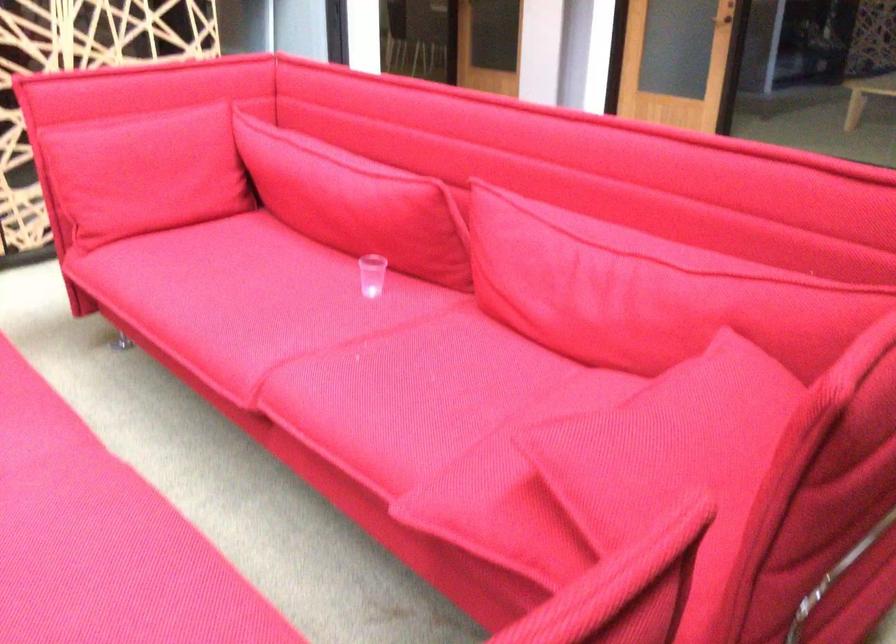
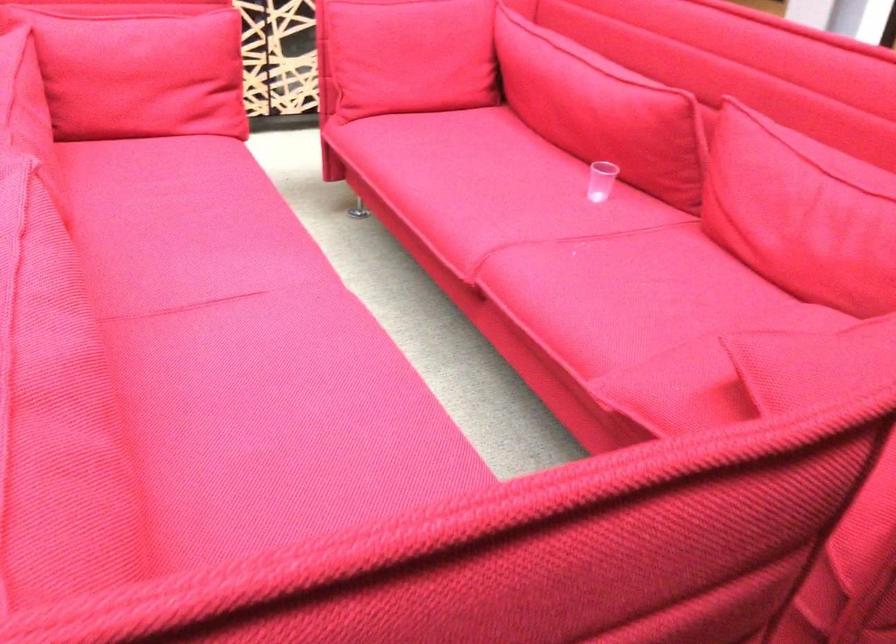
Find the pixel in the second image that matches point 256,307 in the first image.

(488, 192)